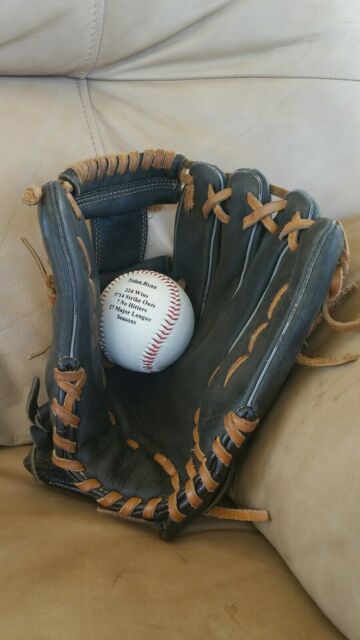
I want to click on brown suede seatback, so click(320, 477).